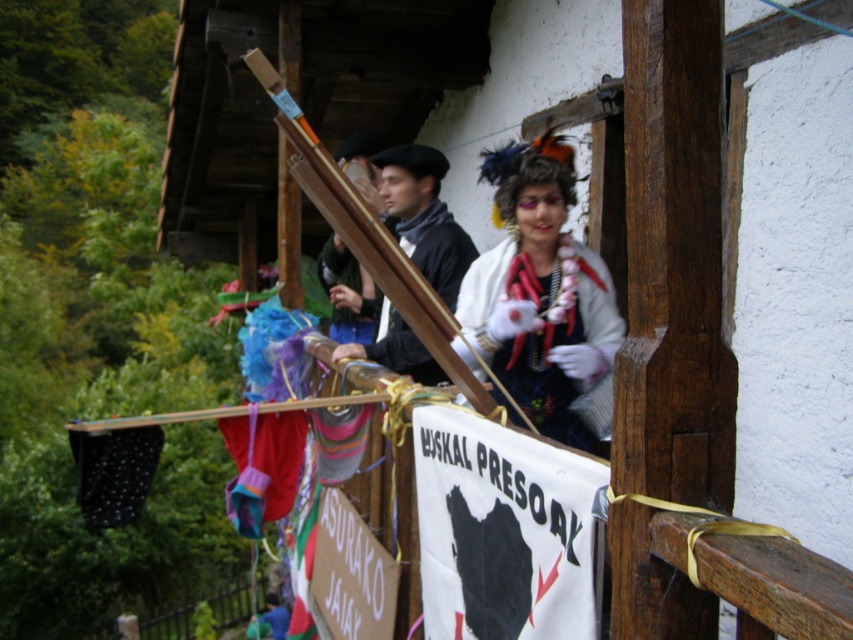
You are standing on the rustic wooden balcony and want to locate the fuzzy white scarf at upper center. According to the coordinates provided, where exactly should you look?

The fuzzy white scarf at upper center is located at point coordinates [538,294].

You are an observer on the balcony and want to find both the fuzzy white scarf at upper center and the velvet red gloves at center. Which object is positioned more to the right?

The fuzzy white scarf at upper center is positioned more to the right than the velvet red gloves at center.